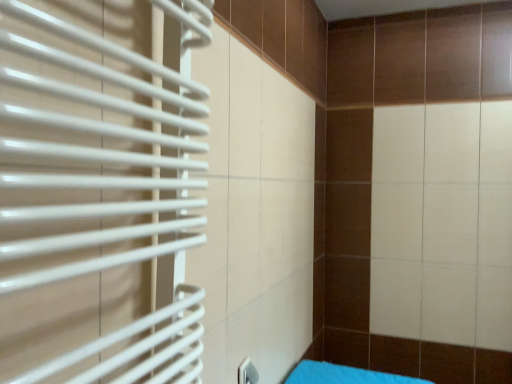
Question: Does blue fabric bed at lower right have a greater height compared to white matte radiator at left?

Choices:
 (A) no
 (B) yes

Answer: (A)

Question: Is the depth of blue fabric bed at lower right less than that of white matte radiator at left?

Choices:
 (A) yes
 (B) no

Answer: (B)

Question: Is blue fabric bed at lower right outside of white matte radiator at left?

Choices:
 (A) yes
 (B) no

Answer: (A)

Question: Does blue fabric bed at lower right have a lesser height compared to white matte radiator at left?

Choices:
 (A) yes
 (B) no

Answer: (A)

Question: Are blue fabric bed at lower right and white matte radiator at left far apart?

Choices:
 (A) no
 (B) yes

Answer: (B)

Question: Is the depth of blue fabric bed at lower right greater than that of white matte radiator at left?

Choices:
 (A) yes
 (B) no

Answer: (A)

Question: From a real-world perspective, is white matte radiator at left under blue fabric bed at lower right?

Choices:
 (A) yes
 (B) no

Answer: (B)

Question: Is white matte radiator at left closer to the viewer compared to blue fabric bed at lower right?

Choices:
 (A) no
 (B) yes

Answer: (B)

Question: From the image's perspective, does white matte radiator at left appear higher than blue fabric bed at lower right?

Choices:
 (A) no
 (B) yes

Answer: (B)

Question: Does white matte radiator at left appear on the right side of blue fabric bed at lower right?

Choices:
 (A) no
 (B) yes

Answer: (A)

Question: From the image's perspective, is white matte radiator at left beneath blue fabric bed at lower right?

Choices:
 (A) yes
 (B) no

Answer: (B)

Question: Is white matte radiator at left turned away from blue fabric bed at lower right?

Choices:
 (A) yes
 (B) no

Answer: (B)

Question: Considering the positions of white matte radiator at left and blue fabric bed at lower right in the image, is white matte radiator at left wider or thinner than blue fabric bed at lower right?

Choices:
 (A) thin
 (B) wide

Answer: (A)